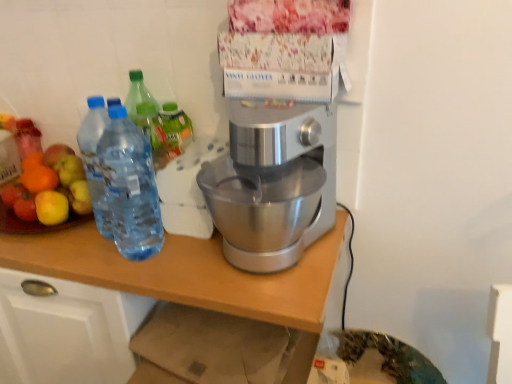
You are a GUI agent. You are given a task and a screenshot of the screen. Output one action in this format:
    pyautogui.click(x=<x>, y=<y>)
    Task: Click on the vacant space positioned to the left of transparent plastic bottles at left
    Image resolution: width=512 pixels, height=384 pixels.
    Given the screenshot: What is the action you would take?
    pyautogui.click(x=76, y=256)